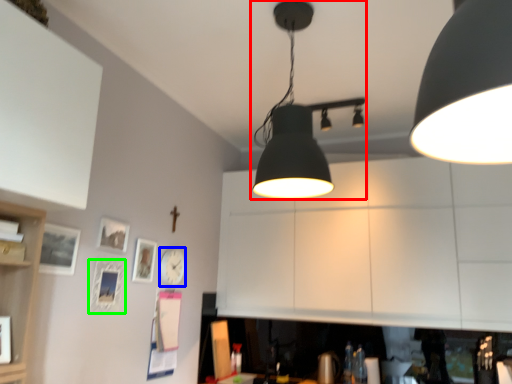
Question: Considering the real-world distances, which object is closest to lamp (highlighted by a red box)? clock (highlighted by a blue box) or picture frame (highlighted by a green box).

Choices:
 (A) clock
 (B) picture frame

Answer: (B)